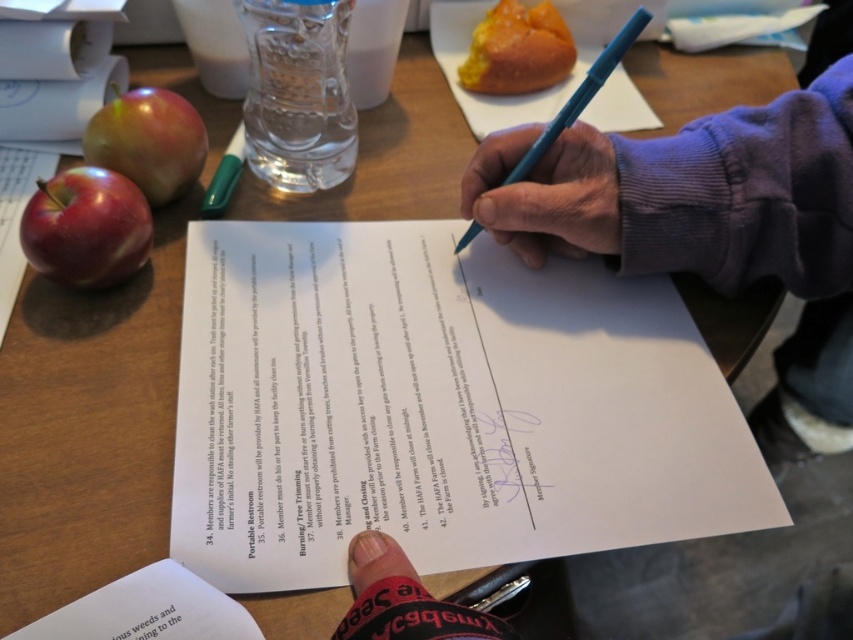
Question: Which point appears closest to the camera in this image?

Choices:
 (A) (151, 124)
 (B) (537, 141)

Answer: (B)

Question: Which point is farther to the camera?

Choices:
 (A) (117, 102)
 (B) (490, 145)
 (C) (41, 248)

Answer: (A)

Question: Is shiny red apple at left thinner than black paper at lower left?

Choices:
 (A) no
 (B) yes

Answer: (A)

Question: Can you confirm if shiny red apple at left is smaller than golden mashed potato at upper center?

Choices:
 (A) yes
 (B) no

Answer: (A)

Question: Can you confirm if white paper at center is positioned above shiny red apple at left?

Choices:
 (A) yes
 (B) no

Answer: (B)

Question: Based on their relative distances, which object is farther from the golden mashed potato at upper center?

Choices:
 (A) smooth blue pen at center
 (B) white paper at lower left

Answer: (B)